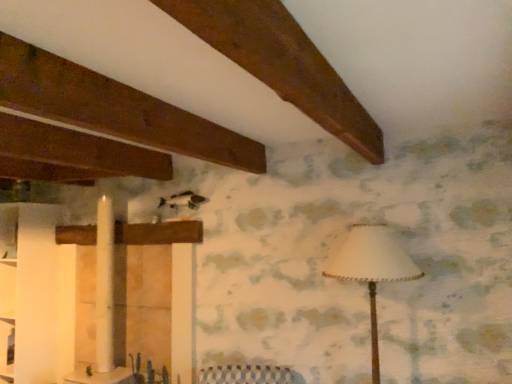
Describe the element at coordinates (371, 269) in the screenshot. I see `white fabric lampshade at right` at that location.

What is the approximate width of white fabric lampshade at right?

white fabric lampshade at right is 20.76 inches wide.

Measure the distance between white fabric lampshade at right and camera.

The depth of white fabric lampshade at right is 2.11 meters.

Locate an element on the screen. white fabric lampshade at right is located at coordinates (371, 269).

Where is `white fabric lampshade at right`? white fabric lampshade at right is located at coordinates (371, 269).